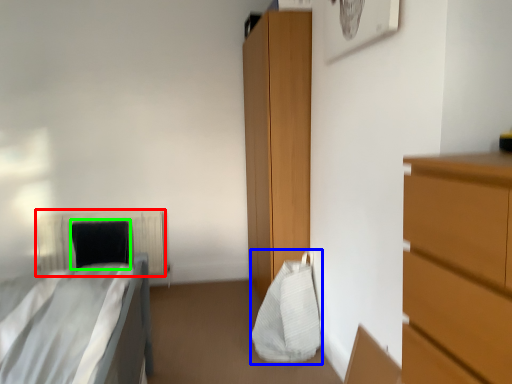
Question: Estimate the real-world distances between objects in this image. Which object is closer to radiator (highlighted by a red box), bag (highlighted by a blue box) or pillow (highlighted by a green box)?

Choices:
 (A) bag
 (B) pillow

Answer: (B)